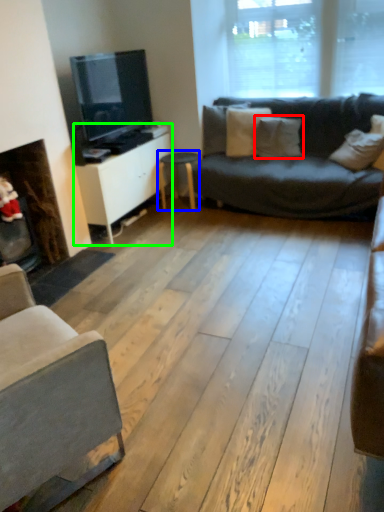
Question: Which is nearer to the pillow (highlighted by a red box)? table (highlighted by a blue box) or cabinetry (highlighted by a green box).

Choices:
 (A) table
 (B) cabinetry

Answer: (A)